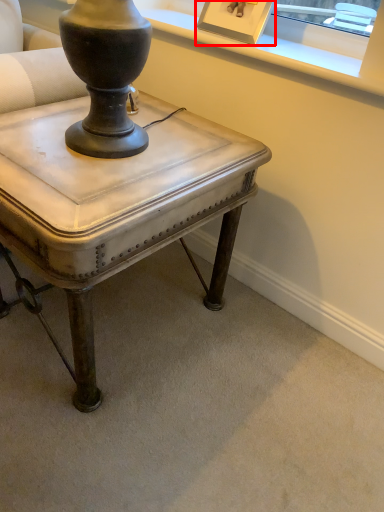
Question: From the image's perspective, where is picture frame (annotated by the red box) located relative to table?

Choices:
 (A) below
 (B) above

Answer: (B)